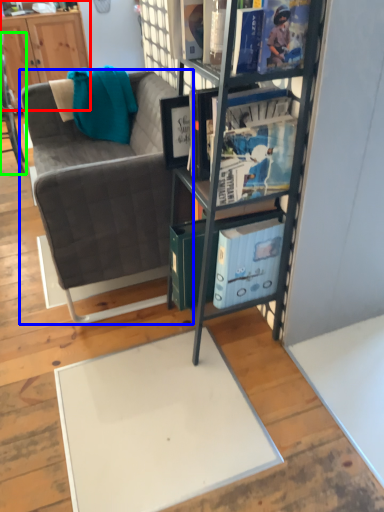
Question: Which is farther away from cabinetry (highlighted by a red box)? studio couch (highlighted by a blue box) or chair (highlighted by a green box)?

Choices:
 (A) studio couch
 (B) chair

Answer: (A)